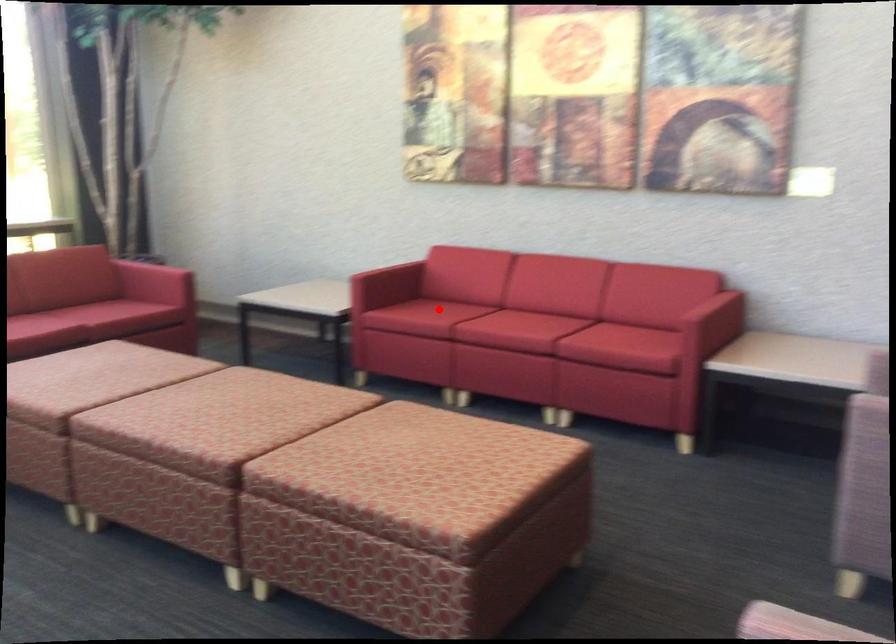
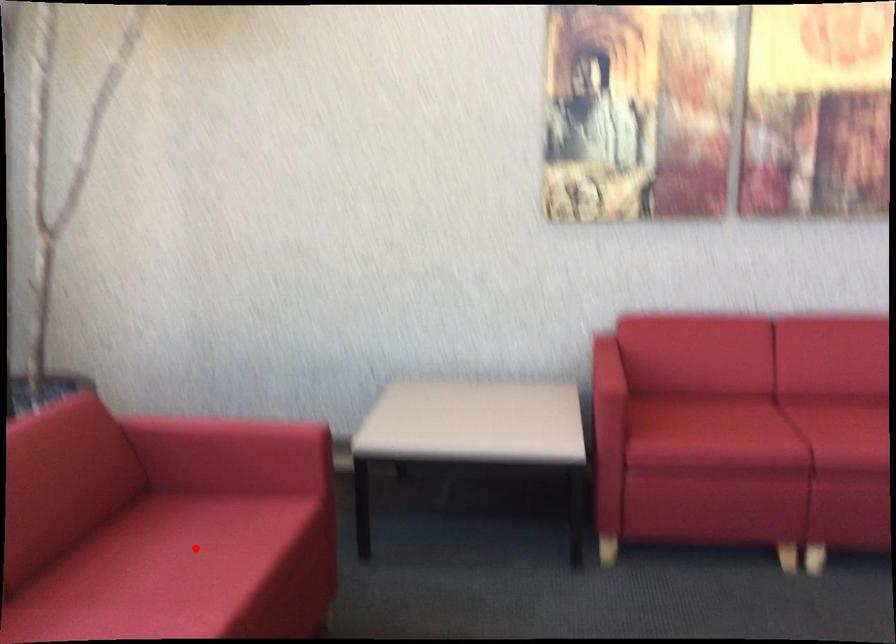
I am providing you with two images of the same scene from different viewpoints. A red point is marked on the first image and another point is marked on the second image. Is the marked point in image1 the same physical position as the marked point in image2?

No